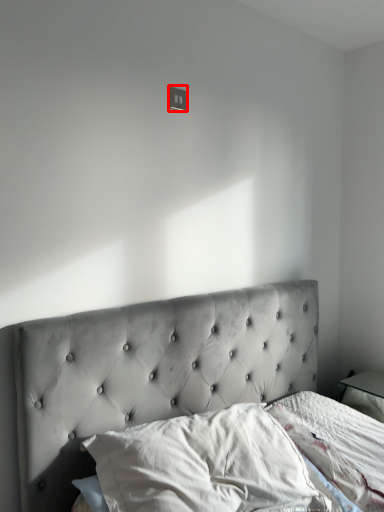
Question: From the image's perspective, where is electric outlet (annotated by the red box) located in relation to pillow in the image?

Choices:
 (A) above
 (B) below

Answer: (A)